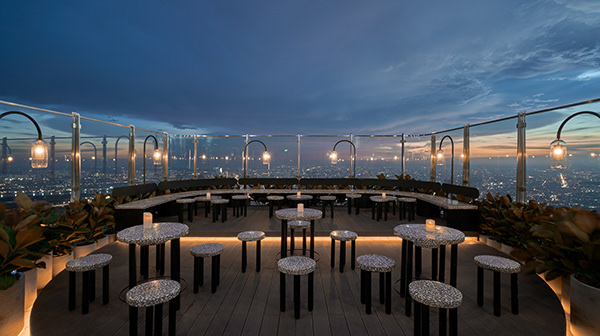
Where is `recessed lighting`? Image resolution: width=600 pixels, height=336 pixels. recessed lighting is located at coordinates (27, 319), (205, 236), (370, 236), (565, 294).